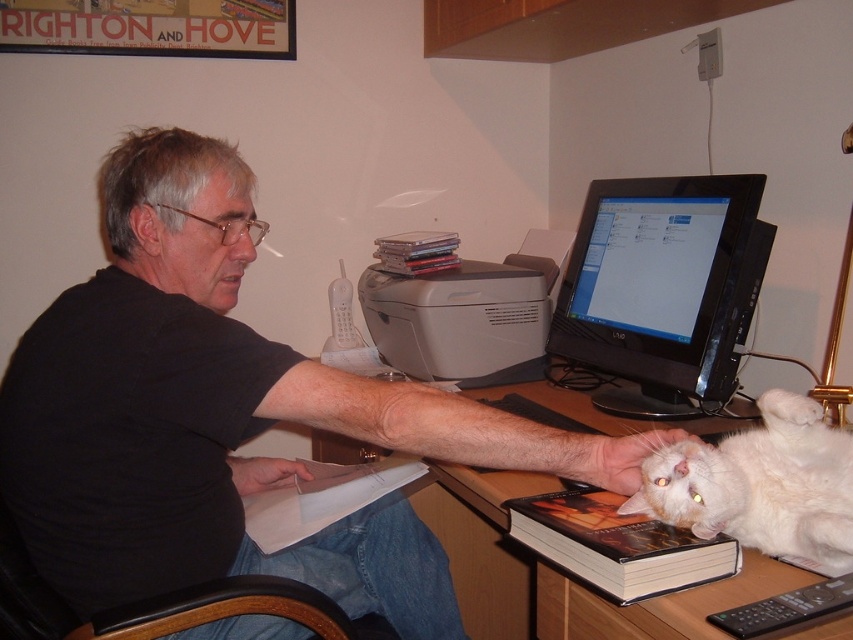
Which is more to the left, black matte shirt at upper left or hardcover book at lower right?

black matte shirt at upper left is more to the left.

Does black matte shirt at upper left appear under hardcover book at lower right?

No, black matte shirt at upper left is not below hardcover book at lower right.

Is point (20, 397) less distant than point (572, 536)?

No.

At what (x,y) coordinates should I click in order to perform the action: click on black matte shirt at upper left. Please return your answer as a coordinate pair (x, y). The width and height of the screenshot is (853, 640). Looking at the image, I should click on (225, 416).

Can you confirm if wooden desk at center is smaller than white fluffy cat at lower right?

No.

Is wooden desk at center taller than white fluffy cat at lower right?

Indeed, wooden desk at center has a greater height compared to white fluffy cat at lower right.

Where is `wooden desk at center`? This screenshot has height=640, width=853. wooden desk at center is located at coordinates (489, 548).

The height and width of the screenshot is (640, 853). Identify the location of wooden desk at center. (489, 548).

Is black matte shirt at upper left below white fluffy cat at lower right?

Actually, black matte shirt at upper left is above white fluffy cat at lower right.

Is point (160, 291) in front of point (792, 401)?

No, it is not.

Is point (172, 497) in front of point (824, 540)?

No, (172, 497) is behind (824, 540).

Find the location of `black matte shirt at upper left`. black matte shirt at upper left is located at coordinates (225, 416).